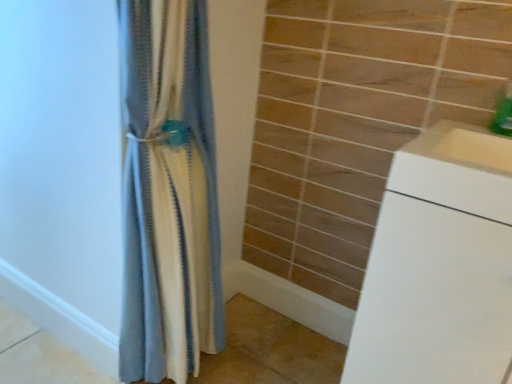
Question: Considering the relative sizes of white matte drawer at right and green plastic soap dispenser at upper right in the image provided, is white matte drawer at right shorter than green plastic soap dispenser at upper right?

Choices:
 (A) yes
 (B) no

Answer: (A)

Question: Considering the relative sizes of white matte drawer at right and green plastic soap dispenser at upper right in the image provided, is white matte drawer at right smaller than green plastic soap dispenser at upper right?

Choices:
 (A) yes
 (B) no

Answer: (B)

Question: Are white matte drawer at right and green plastic soap dispenser at upper right located far from each other?

Choices:
 (A) yes
 (B) no

Answer: (B)

Question: Is green plastic soap dispenser at upper right completely or partially inside white matte drawer at right?

Choices:
 (A) no
 (B) yes

Answer: (A)

Question: Could you tell me if white matte drawer at right is turned towards green plastic soap dispenser at upper right?

Choices:
 (A) no
 (B) yes

Answer: (A)

Question: From their relative heights in the image, would you say white glossy cabinet at lower right is taller or shorter than white matte drawer at right?

Choices:
 (A) short
 (B) tall

Answer: (B)

Question: Which is correct: white glossy cabinet at lower right is inside white matte drawer at right, or outside of it?

Choices:
 (A) inside
 (B) outside

Answer: (B)

Question: In terms of width, does white glossy cabinet at lower right look wider or thinner when compared to white matte drawer at right?

Choices:
 (A) thin
 (B) wide

Answer: (B)

Question: Is white glossy cabinet at lower right in front of or behind white matte drawer at right in the image?

Choices:
 (A) front
 (B) behind

Answer: (A)

Question: Looking at the image, does blue textured fabric at center seem bigger or smaller compared to white glossy cabinet at lower right?

Choices:
 (A) big
 (B) small

Answer: (B)

Question: Based on their positions, is blue textured fabric at center located to the left or right of white glossy cabinet at lower right?

Choices:
 (A) right
 (B) left

Answer: (B)

Question: From the image's perspective, is blue textured fabric at center located above or below white glossy cabinet at lower right?

Choices:
 (A) below
 (B) above

Answer: (B)

Question: Relative to white glossy cabinet at lower right, is blue textured fabric at center in front or behind?

Choices:
 (A) behind
 (B) front

Answer: (A)

Question: From the image's perspective, is blue textured fabric at center above or below green plastic soap dispenser at upper right?

Choices:
 (A) above
 (B) below

Answer: (B)

Question: Considering the positions of blue textured fabric at center and green plastic soap dispenser at upper right in the image, is blue textured fabric at center taller or shorter than green plastic soap dispenser at upper right?

Choices:
 (A) tall
 (B) short

Answer: (A)